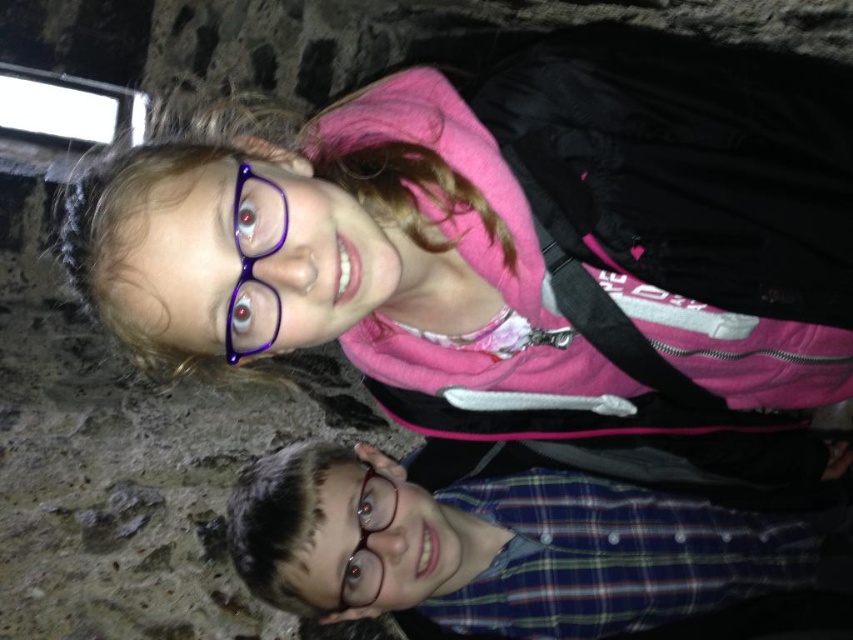
Can you confirm if matte pink jacket at upper center is positioned to the right of purple plastic glasses at upper center?

Correct, you'll find matte pink jacket at upper center to the right of purple plastic glasses at upper center.

Between matte pink jacket at upper center and purple plastic glasses at upper center, which one has more height?

matte pink jacket at upper center is taller.

Does point (780, 380) come behind point (256, 348)?

Yes, point (780, 380) is farther from viewer.

Locate an element on the screen. This screenshot has height=640, width=853. matte pink jacket at upper center is located at coordinates (526, 244).

Is plaid fabric shirt at lower right taller than purple plastic glasses at upper center?

Indeed, plaid fabric shirt at lower right has a greater height compared to purple plastic glasses at upper center.

Can you confirm if plaid fabric shirt at lower right is wider than purple plastic glasses at upper center?

Yes.

Does point (508, 602) come in front of point (263, 321)?

That is False.

The height and width of the screenshot is (640, 853). I want to click on plaid fabric shirt at lower right, so click(x=497, y=547).

From the picture: Which is more to the right, matte pink jacket at upper center or plaid fabric shirt at lower right?

Positioned to the right is matte pink jacket at upper center.

Who is lower down, matte pink jacket at upper center or plaid fabric shirt at lower right?

Positioned lower is plaid fabric shirt at lower right.

Between point (115, 211) and point (316, 529), which one is positioned in front?

Point (115, 211) is in front.

The height and width of the screenshot is (640, 853). What are the coordinates of `matte pink jacket at upper center` in the screenshot? It's located at (526, 244).